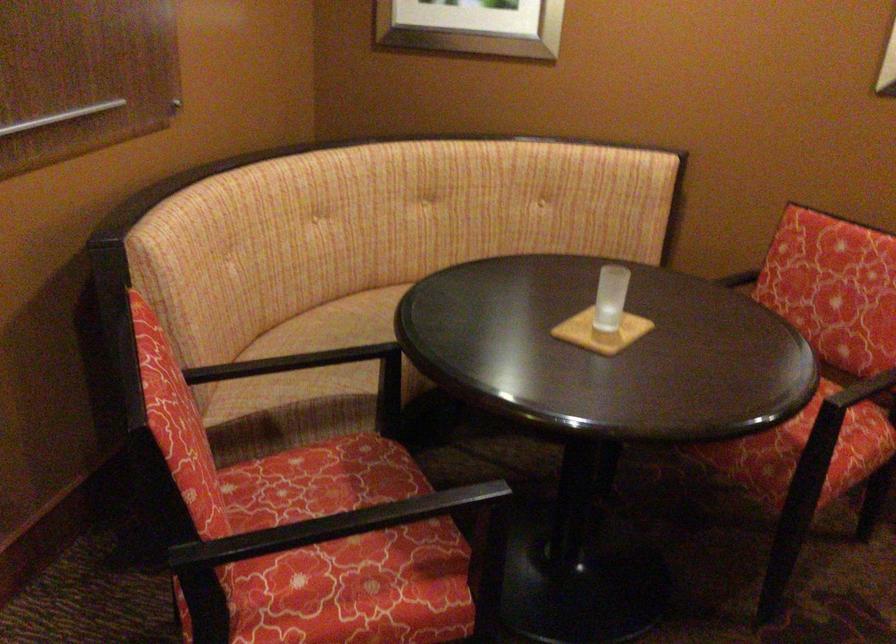
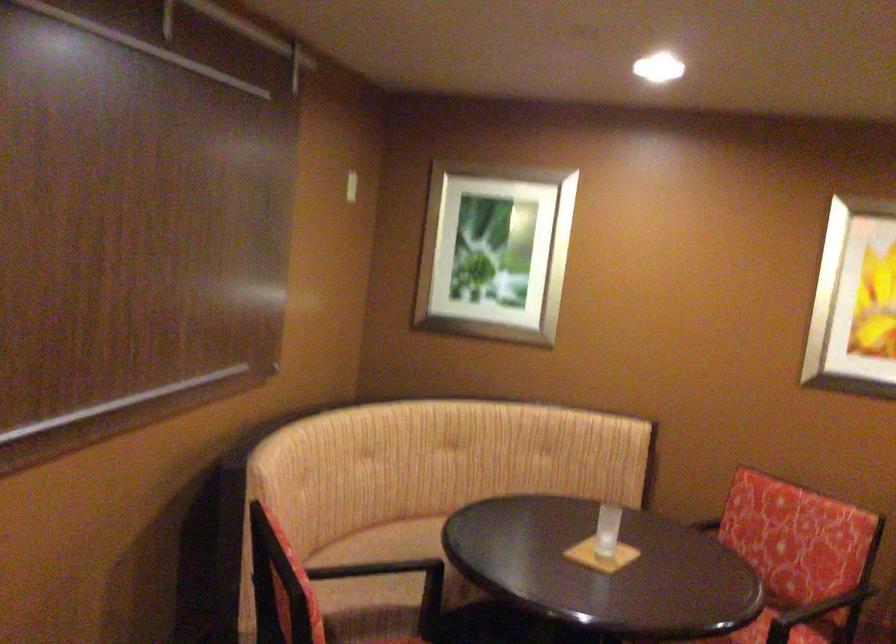
Locate, in the second image, the point that corresponds to pixel 616 283 in the first image.

(607, 529)